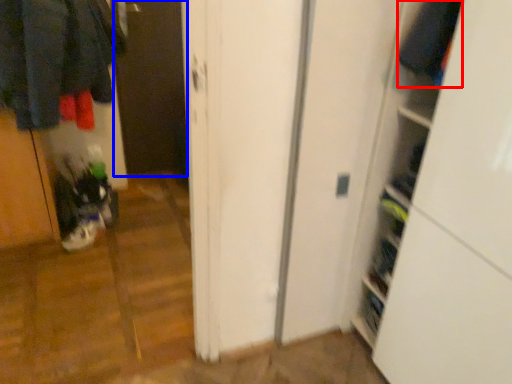
Question: Which object is further to the camera taking this photo, clothing (highlighted by a red box) or screen door (highlighted by a blue box)?

Choices:
 (A) clothing
 (B) screen door

Answer: (B)